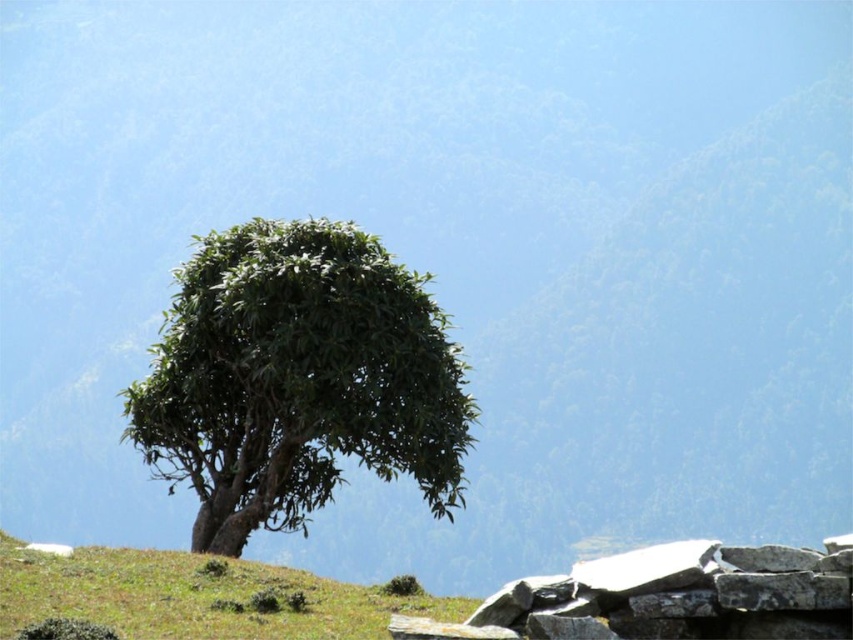
Between point (355, 243) and point (396, 602), which one is positioned in front?

Point (396, 602)

In the scene shown: Can you confirm if green leafy tree at center is bigger than green grassy at lower left?

Actually, green leafy tree at center might be smaller than green grassy at lower left.

This screenshot has height=640, width=853. What do you see at coordinates (297, 380) in the screenshot? I see `green leafy tree at center` at bounding box center [297, 380].

The width and height of the screenshot is (853, 640). Find the location of `green leafy tree at center`. green leafy tree at center is located at coordinates (297, 380).